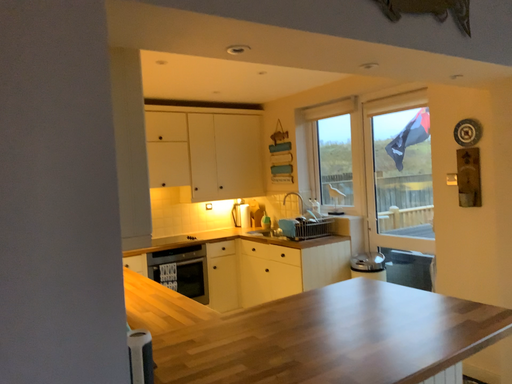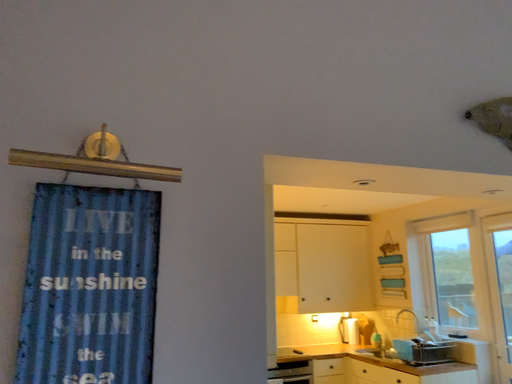
Question: How did the camera likely rotate when shooting the video?

Choices:
 (A) rotated downward
 (B) rotated upward

Answer: (B)